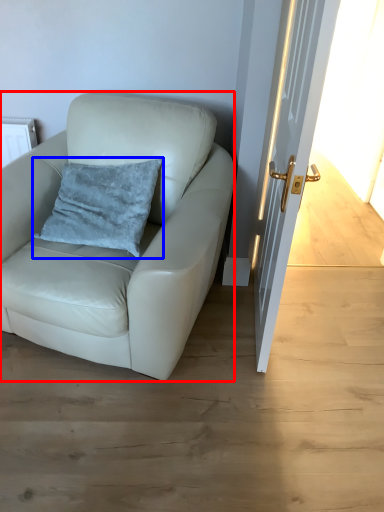
Question: Which object appears closest to the camera in this image, chair (highlighted by a red box) or pillow (highlighted by a blue box)?

Choices:
 (A) chair
 (B) pillow

Answer: (A)